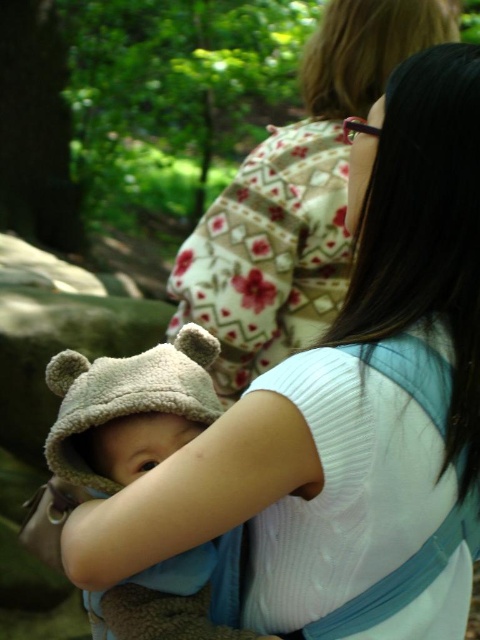
Question: Which point is closer to the camera taking this photo?

Choices:
 (A) (110, 449)
 (B) (294, 260)

Answer: (A)

Question: Among these points, which one is nearest to the camera?

Choices:
 (A) click(370, 92)
 (B) click(192, 349)

Answer: (B)

Question: Does floral fabric kimono at upper center have a greater width compared to soft beige hat at center?

Choices:
 (A) yes
 (B) no

Answer: (A)

Question: Does floral fabric kimono at upper center have a lesser width compared to soft beige hat at center?

Choices:
 (A) yes
 (B) no

Answer: (B)

Question: Is floral fabric kimono at upper center below soft beige hat at center?

Choices:
 (A) no
 (B) yes

Answer: (A)